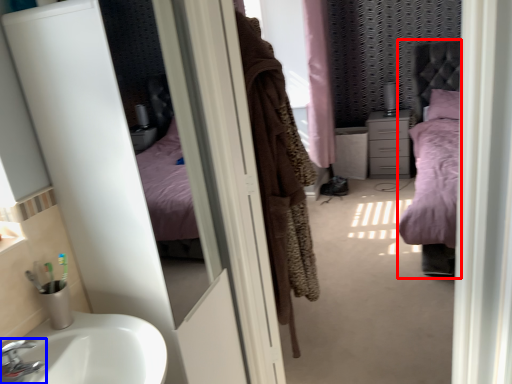
Question: Which point is closer to the camera, bed (highlighted by a red box) or tap (highlighted by a blue box)?

Choices:
 (A) bed
 (B) tap

Answer: (B)